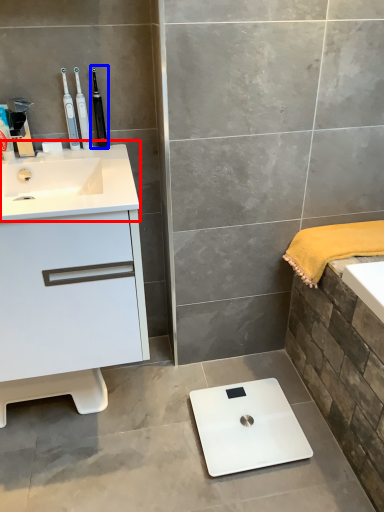
Question: Which object is closer to the camera taking this photo, sink (highlighted by a red box) or toothbrush (highlighted by a blue box)?

Choices:
 (A) sink
 (B) toothbrush

Answer: (A)